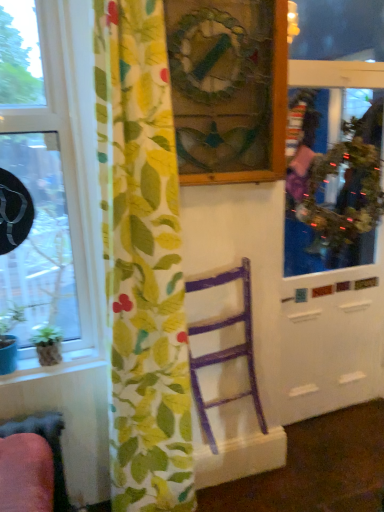
Question: Is green glossy houseplant at lower left smaller than green textured wreath at upper right?

Choices:
 (A) yes
 (B) no

Answer: (A)

Question: From a real-world perspective, is green glossy houseplant at lower left located higher than green textured wreath at upper right?

Choices:
 (A) no
 (B) yes

Answer: (A)

Question: Is the depth of green glossy houseplant at lower left less than that of green textured wreath at upper right?

Choices:
 (A) no
 (B) yes

Answer: (B)

Question: Is green glossy houseplant at lower left bigger than green textured wreath at upper right?

Choices:
 (A) no
 (B) yes

Answer: (A)

Question: From the image's perspective, is green glossy houseplant at lower left located above green textured wreath at upper right?

Choices:
 (A) no
 (B) yes

Answer: (A)

Question: Could green textured wreath at upper right be considered to be inside green glossy houseplant at lower left?

Choices:
 (A) no
 (B) yes

Answer: (A)

Question: Considering the relative sizes of floral fabric curtain at left and purple wood chair at center in the image provided, is floral fabric curtain at left wider than purple wood chair at center?

Choices:
 (A) yes
 (B) no

Answer: (A)

Question: Is floral fabric curtain at left positioned with its back to purple wood chair at center?

Choices:
 (A) no
 (B) yes

Answer: (A)

Question: Is floral fabric curtain at left closer to the viewer compared to purple wood chair at center?

Choices:
 (A) yes
 (B) no

Answer: (A)

Question: Is floral fabric curtain at left further to the viewer compared to purple wood chair at center?

Choices:
 (A) yes
 (B) no

Answer: (B)

Question: Is floral fabric curtain at left facing towards purple wood chair at center?

Choices:
 (A) no
 (B) yes

Answer: (A)

Question: Is floral fabric curtain at left at the right side of purple wood chair at center?

Choices:
 (A) yes
 (B) no

Answer: (B)

Question: From the image's perspective, is metallic reflective screen door at right located beneath floral fabric curtain at left?

Choices:
 (A) yes
 (B) no

Answer: (B)